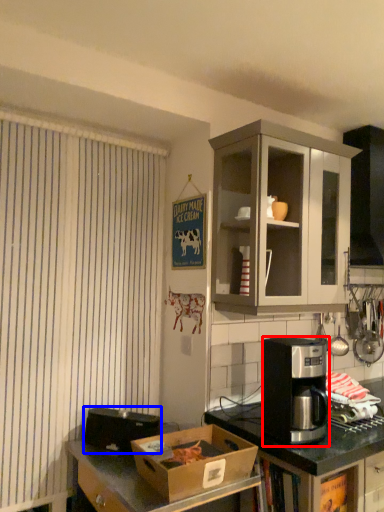
Question: Among these objects, which one is nearest to the camera, coffee maker (highlighted by a red box) or appliance (highlighted by a blue box)?

Choices:
 (A) coffee maker
 (B) appliance

Answer: (A)